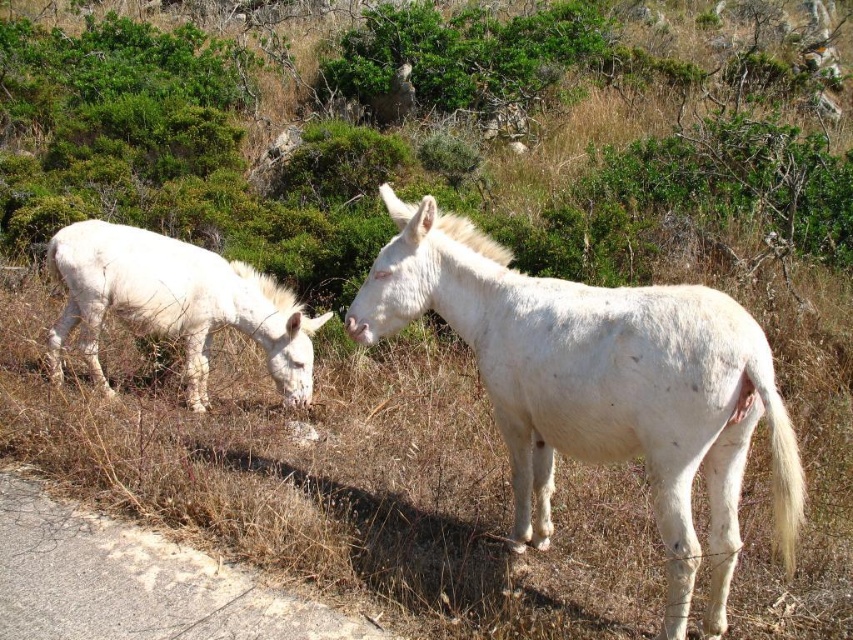
You are a photographer aiming to capture a closeup shot of the white matte donkey at center. Given that the camera is focused at point 0.5 on the x and y axes, will you need to adjust the focus to the left or right to center the donkey in your shot?

The white matte donkey at center is located at point 0.605 on the x axis, which is to the right of the camera focus point at 0.5. Therefore, you need to adjust the focus to the right to center the donkey in your shot.

You are a farmer who needs to separate two white matte donkeys using a fence. The fence you have is 1.5 meters long. Given that the distance between the white matte donkey at center and the white matte donkey at left is known, can the fence fit between them to keep them apart?

The distance between the white matte donkey at center and the white matte donkey at left is 1.69 meters. Since the fence is 1.5 meters long, it is shorter than the distance between them. Therefore, the fence cannot fit between them to keep them apart.